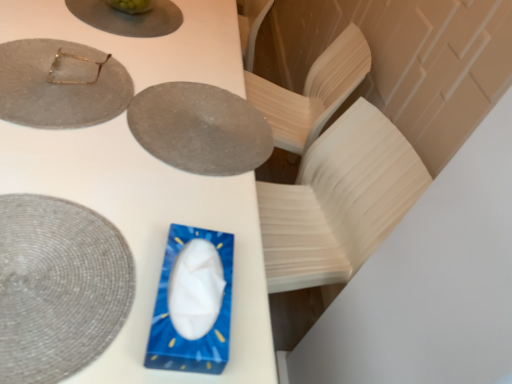
Find the location of a particular element. This screenshot has width=512, height=384. vacant area that is situated to the right of matte gray placemat at upper left, which appears as the third plate when ordered from the bottom is located at coordinates (175, 127).